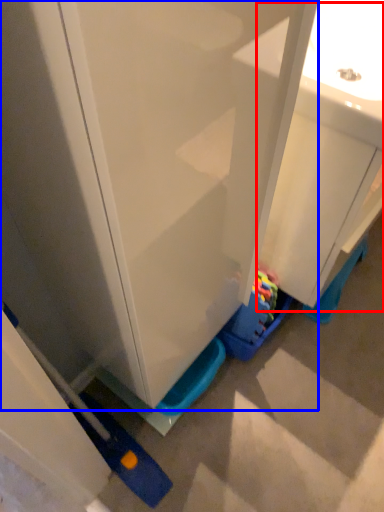
Question: Which object is further to the camera taking this photo, sink (highlighted by a red box) or cabinetry (highlighted by a blue box)?

Choices:
 (A) sink
 (B) cabinetry

Answer: (A)